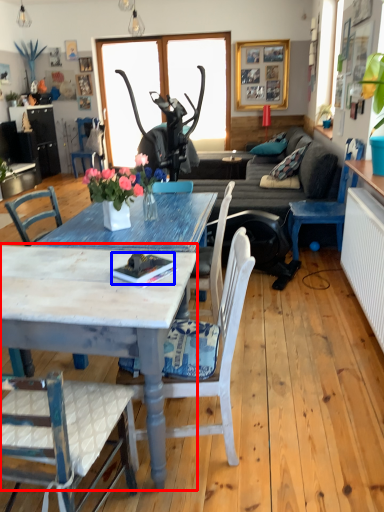
Question: Which point is further to the camera, coffee table (highlighted by a red box) or book (highlighted by a blue box)?

Choices:
 (A) coffee table
 (B) book

Answer: (B)